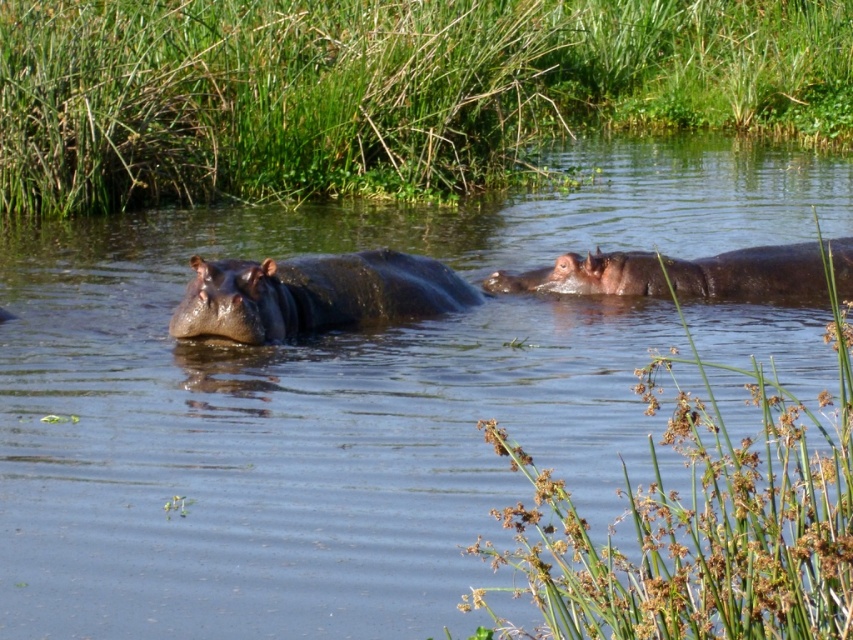
You are a wildlife photographer aiming to capture the tallest hippo in the scene. Given the presence of the shiny brown hippo at center and the brown matte hippo at right, which one should you focus your camera on?

The shiny brown hippo at center is much taller than the brown matte hippo at right, so you should focus your camera on the shiny brown hippo at center to capture the tallest hippo in the scene.

You are a small bird flying over the scene. You want to land on the highest point between the green grass at upper center and the shiny brown hippo at center. Which one should you choose?

The green grass at upper center has a greater height compared to the shiny brown hippo at center, so you should choose the green grass at upper center to land on the highest point.

You are a photographer trying to capture the shiny brown hippo at center in your shot. However, there is green grass at upper center blocking part of the hippo. Can you adjust your camera angle to avoid the grass while still keeping the hippo in the frame?

The green grass at upper center is located above the shiny brown hippo at center, so you can lower your camera angle slightly to position the grass above the hippo in the frame, allowing the hippo to be fully visible without obstruction.